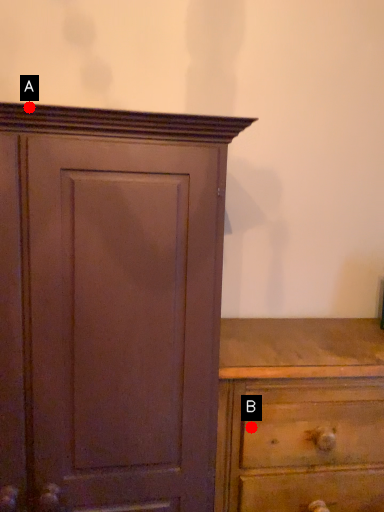
Question: Two points are circled on the image, labeled by A and B beside each circle. Which point is further to the camera?

Choices:
 (A) A is further
 (B) B is further

Answer: (B)